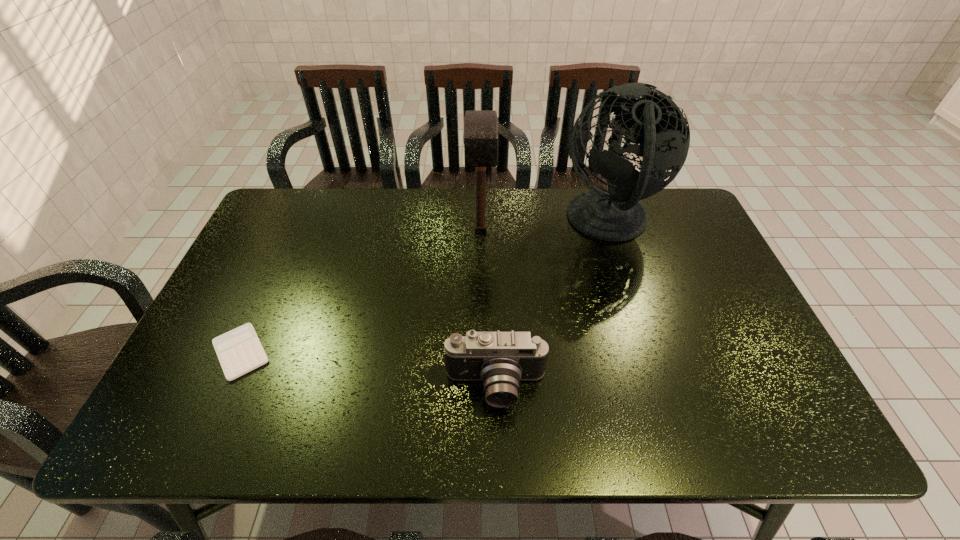
Find the location of `the tallest object`. the tallest object is located at coordinates (658, 129).

Locate an element on the screen. the rightmost object is located at coordinates (658, 129).

In order to click on mallet in this screenshot , I will do `click(480, 137)`.

Where is `the second shortest object`? the second shortest object is located at coordinates point(500,360).

At what (x,y) coordinates should I click in order to perform the action: click on the shortest object. Please return your answer as a coordinate pair (x, y). Image resolution: width=960 pixels, height=540 pixels. Looking at the image, I should click on (239, 351).

Find the location of `the leftmost object`. the leftmost object is located at coordinates (239, 351).

The height and width of the screenshot is (540, 960). Identify the location of blank space located on the front-facing side of the rightmost object. (531, 222).

Image resolution: width=960 pixels, height=540 pixels. Find the location of `free space located on the front-facing side of the rightmost object`. free space located on the front-facing side of the rightmost object is located at coordinates (455, 222).

Image resolution: width=960 pixels, height=540 pixels. What are the coordinates of `blank area located on the front-facing side of the rightmost object` in the screenshot? It's located at (527, 222).

Image resolution: width=960 pixels, height=540 pixels. What are the coordinates of `free space located 0.130m on the right of the mallet` in the screenshot? It's located at coord(537,231).